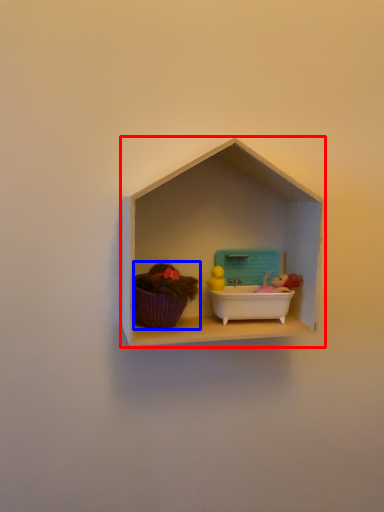
Question: Which point is further to the camera, shelf (highlighted by a red box) or toy (highlighted by a blue box)?

Choices:
 (A) shelf
 (B) toy

Answer: (B)